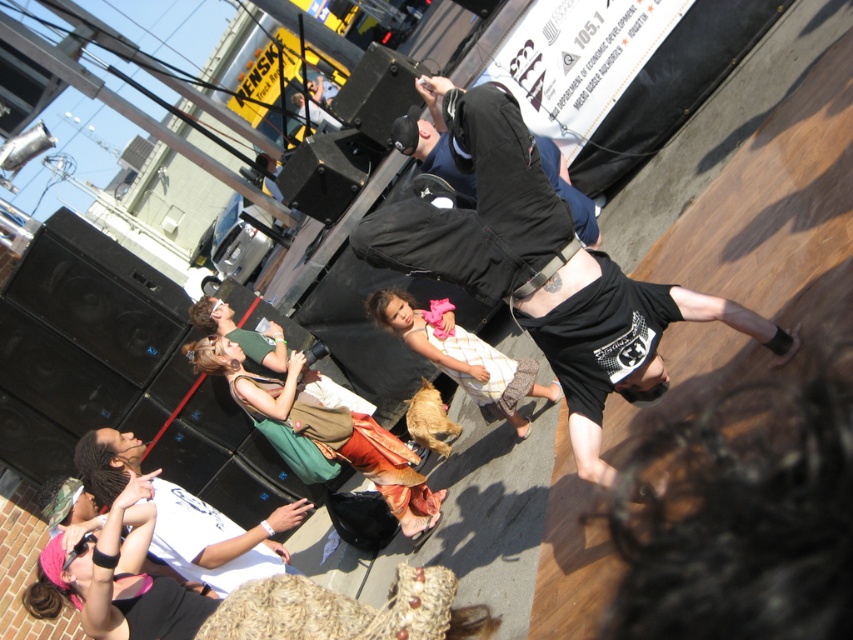
Question: Does black cotton t-shirt at center lie behind white cotton shirt at lower left?

Choices:
 (A) yes
 (B) no

Answer: (B)

Question: Is black cotton t-shirt at center further to the viewer compared to white cotton shirt at lower left?

Choices:
 (A) no
 (B) yes

Answer: (A)

Question: Which point is farther from the camera taking this photo?

Choices:
 (A) (540, 301)
 (B) (268, 573)

Answer: (B)

Question: Does black cotton t-shirt at center have a larger size compared to white cotton shirt at lower left?

Choices:
 (A) no
 (B) yes

Answer: (B)